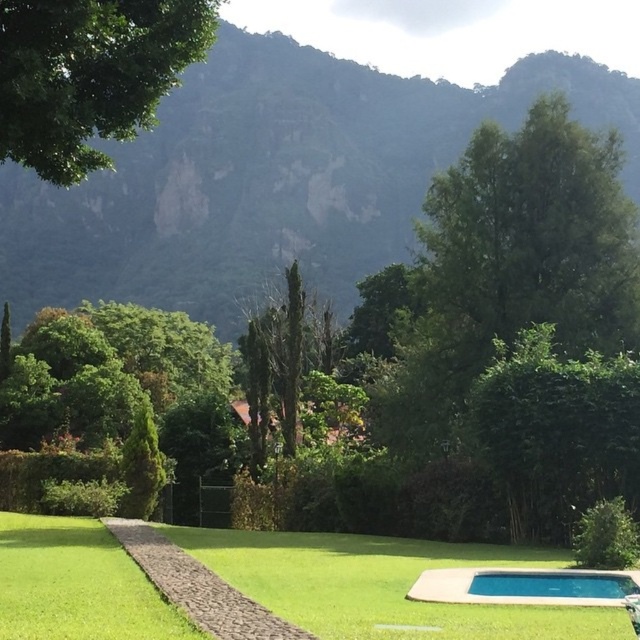
You are standing at the center of the lawn and want to walk towards both the point at coordinates point (x=262, y=253) and point (x=634, y=579). Which point will you reach first?

You will reach point (x=262, y=253) first because it is closer to you than point (x=634, y=579), which is further away.

You are a gardener who needs to trim the green leafy bush at center and clean the blue smooth pool at lower right. Based on their sizes, which task would require more time and effort?

The green leafy bush at center is much taller than the blue smooth pool at lower right, so trimming it would require more time and effort compared to cleaning the pool.